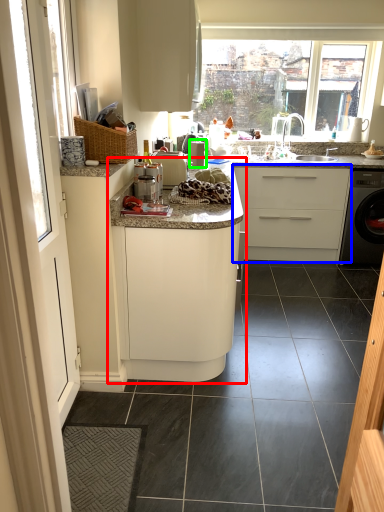
Question: Which object is the farthest from cabinetry (highlighted by a red box)? Choose among these: cabinetry (highlighted by a blue box) or appliance (highlighted by a green box).

Choices:
 (A) cabinetry
 (B) appliance

Answer: (A)